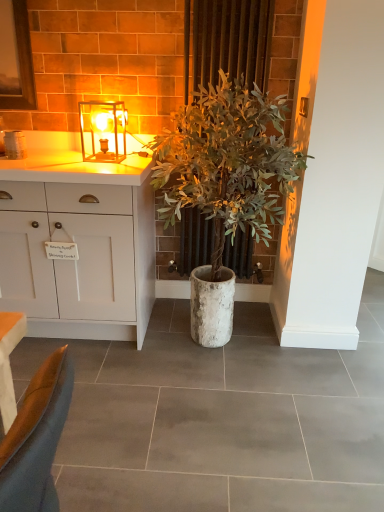
Question: From the image's perspective, is matte glass lamp at upper center located above or below green leafy plant at center?

Choices:
 (A) above
 (B) below

Answer: (A)

Question: Is matte glass lamp at upper center taller or shorter than green leafy plant at center?

Choices:
 (A) tall
 (B) short

Answer: (B)

Question: Based on their relative distances, which object is farther from the white matte cabinet at left?

Choices:
 (A) matte glass lamp at upper center
 (B) green leafy plant at center
 (C) green leafy plant at center

Answer: (B)

Question: Which is nearer to the green leafy plant at center?

Choices:
 (A) matte glass lamp at upper center
 (B) green leafy plant at center
 (C) white matte cabinet at left

Answer: (C)